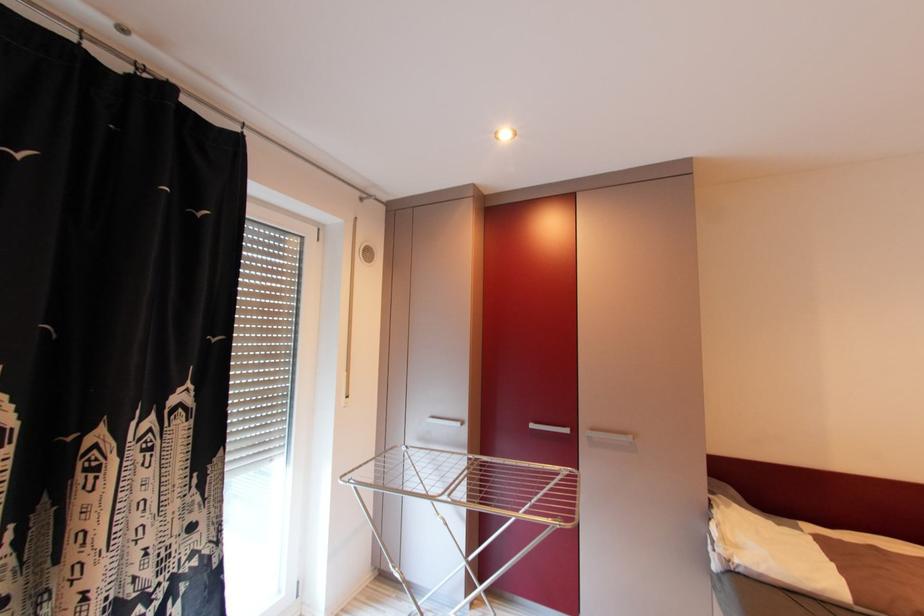
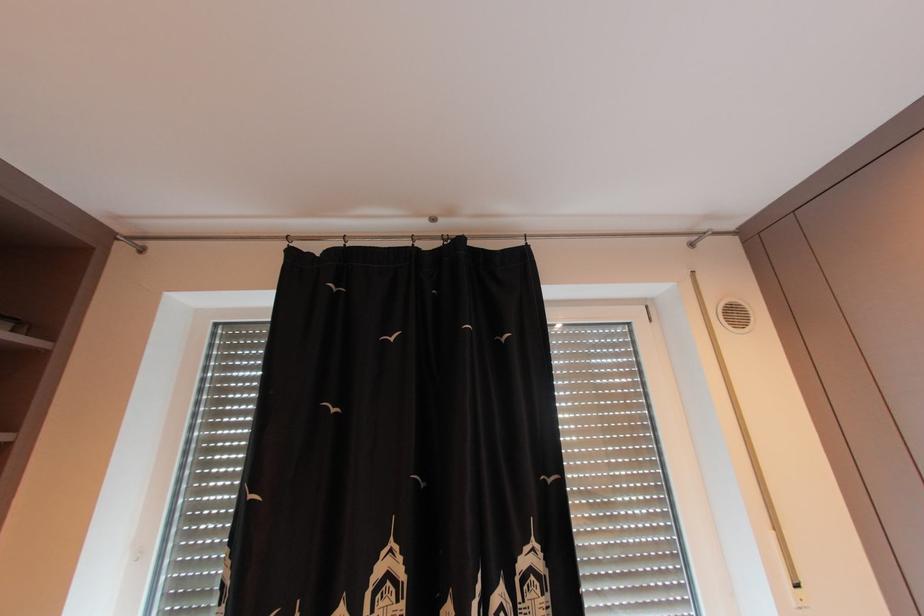
Based on the continuous images, in which direction is the camera rotating?

The camera's rotation is toward left-up.